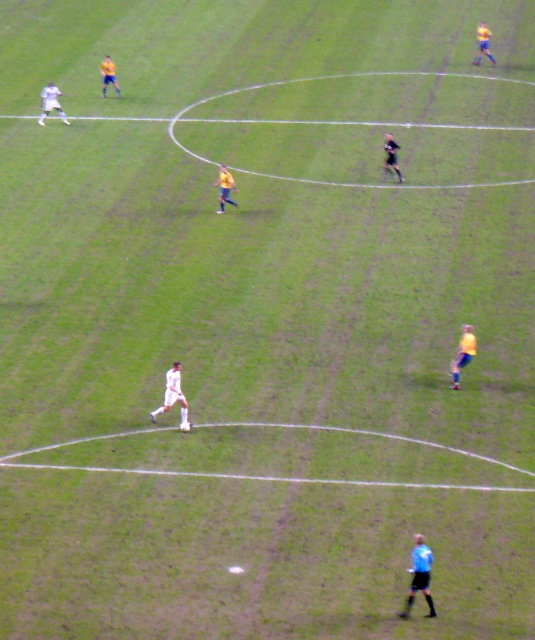
Question: Does yellow matte jersey at right have a larger size compared to yellow jersey at upper left?

Choices:
 (A) no
 (B) yes

Answer: (A)

Question: Is blue uniformed person at lower right positioned behind white matte soccer player at upper left?

Choices:
 (A) yes
 (B) no

Answer: (B)

Question: Which point appears closest to the camera in this image?

Choices:
 (A) (462, 355)
 (B) (219, 166)
 (C) (51, 84)
 (D) (477, 36)

Answer: (A)

Question: Among these points, which one is nearest to the camera?

Choices:
 (A) 113,76
 (B) 48,113

Answer: (B)

Question: Does yellow matte jersey at right come behind white matte soccer player at upper left?

Choices:
 (A) no
 (B) yes

Answer: (A)

Question: Which point appears farthest from the camera in this image?

Choices:
 (A) (485, 38)
 (B) (102, 90)

Answer: (A)